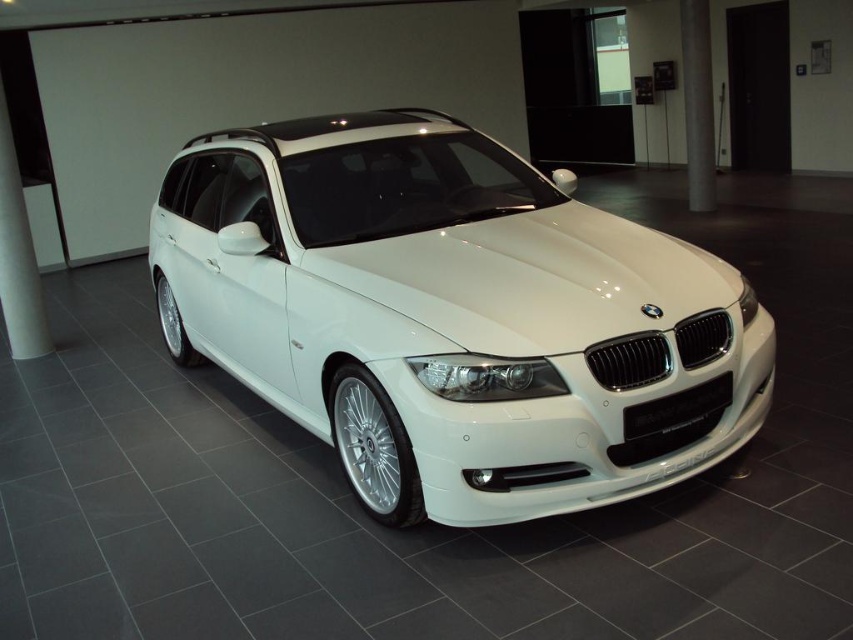
Which of these two, white metallic car at center or white glossy pillar at left, stands shorter?

With less height is white metallic car at center.

Who is taller, white metallic car at center or white glossy pillar at left?

white glossy pillar at left

Where is `white metallic car at center`? white metallic car at center is located at coordinates pyautogui.click(x=454, y=316).

Is point (32, 340) closer to camera compared to point (695, 8)?

Yes, point (32, 340) is closer to viewer.

Does white glossy pillar at left lie behind satin silver pole at center?

That is False.

Is point (22, 348) positioned after point (694, 180)?

That is False.

I want to click on white glossy pillar at left, so click(16, 257).

Is white metallic car at center closer to camera compared to satin silver pole at center?

Yes, white metallic car at center is in front of satin silver pole at center.

What do you see at coordinates (454, 316) in the screenshot? I see `white metallic car at center` at bounding box center [454, 316].

Locate an element on the screen. The image size is (853, 640). white metallic car at center is located at coordinates (454, 316).